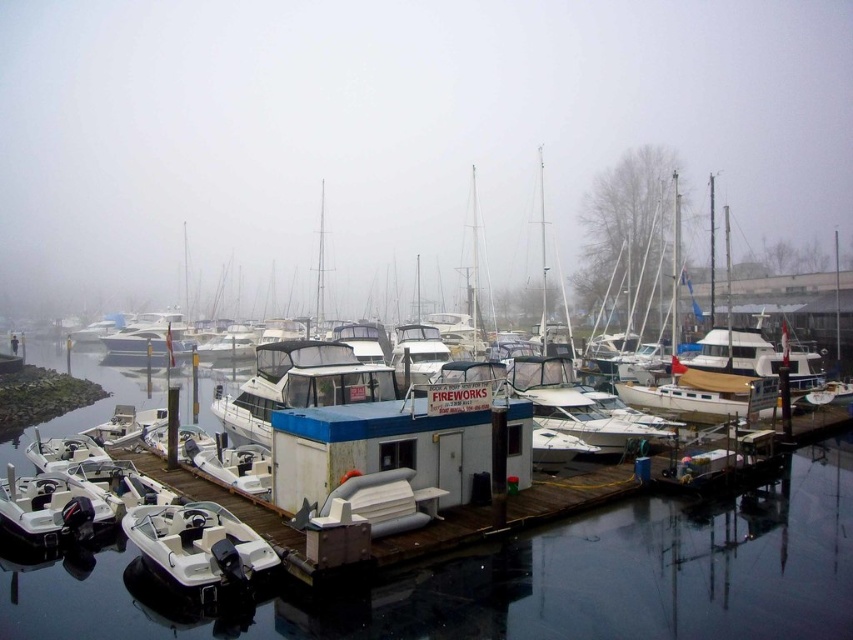
Is point (630, 204) closer to viewer compared to point (161, 552)?

No, (630, 204) is further to viewer.

Can you confirm if white matte houseboat at center is shorter than white rubber boat at lower left?

Incorrect, white matte houseboat at center's height does not fall short of white rubber boat at lower left's.

Does point (666, 166) come closer to viewer compared to point (230, 541)?

No, (666, 166) is further to viewer.

Find the location of `white matte houseboat at center`. white matte houseboat at center is located at coordinates (697, 280).

Who is positioned more to the left, transparent water at center or white matte houseboat at center?

Positioned to the left is transparent water at center.

Does transparent water at center have a lesser height compared to white matte houseboat at center?

Indeed, transparent water at center has a lesser height compared to white matte houseboat at center.

Identify the location of transparent water at center. (538, 579).

In the scene shown: Can you confirm if transparent water at center is positioned above white rubber boat at lower left?

Actually, transparent water at center is below white rubber boat at lower left.

Can you confirm if transparent water at center is positioned below white rubber boat at lower left?

Yes, transparent water at center is below white rubber boat at lower left.

The image size is (853, 640). In order to click on transparent water at center in this screenshot , I will do `click(538, 579)`.